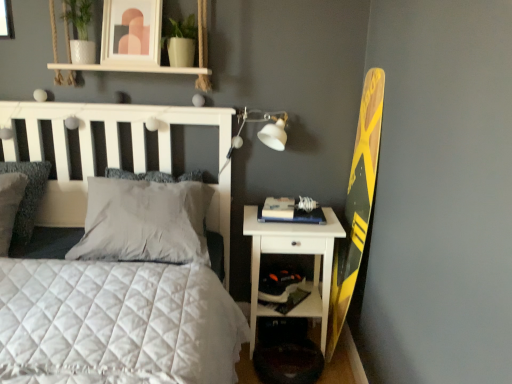
Question: From the image's perspective, is white plastic shelf at lower right above or below matte white picture frame at upper center?

Choices:
 (A) below
 (B) above

Answer: (A)

Question: Considering the positions of white plastic shelf at lower right and matte white picture frame at upper center in the image, is white plastic shelf at lower right taller or shorter than matte white picture frame at upper center?

Choices:
 (A) short
 (B) tall

Answer: (A)

Question: Estimate the real-world distances between objects in this image. Which object is closer to the matte white picture frame at upper center?

Choices:
 (A) white plastic shelf at lower right
 (B) white soft pillow at center, positioned as the first pillow in right-to-left order
 (C) hardcover book at right
 (D) white quilted bed at center
 (E) gray soft pillow at center, marked as the second pillow in a right-to-left arrangement

Answer: (E)

Question: Estimate the real-world distances between objects in this image. Which object is farther from the white quilted bed at center?

Choices:
 (A) white wood nightstand at lower right
 (B) white soft pillow at center, positioned as the first pillow in right-to-left order
 (C) white plastic shelf at lower right
 (D) gray soft pillow at center, which is the 2th pillow in left-to-right order
 (E) hardcover book at right

Answer: (E)